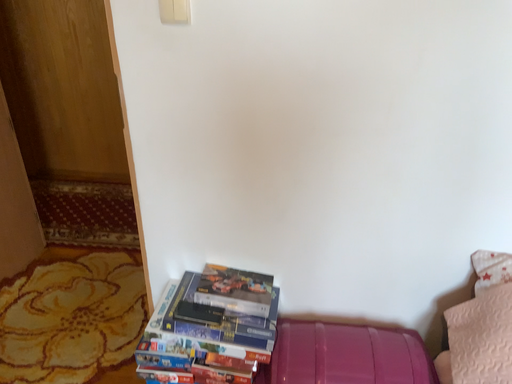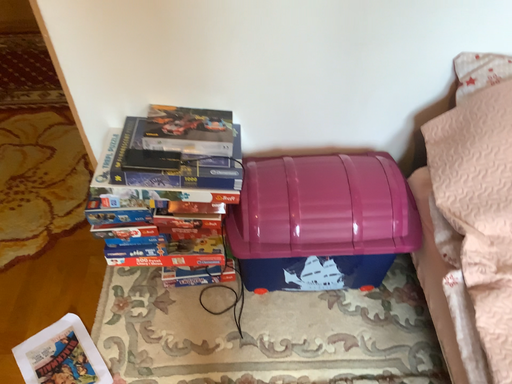
Question: Which way did the camera rotate in the video?

Choices:
 (A) rotated downward
 (B) rotated upward

Answer: (A)